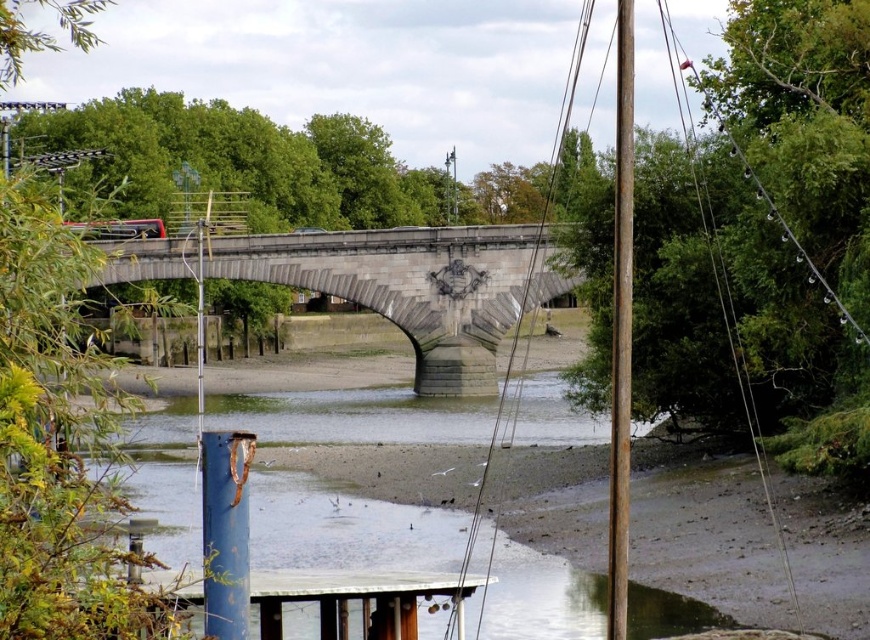
Based on the photo, does gray stone bridge at center appear on the right side of wooden dock at lower center?

No, gray stone bridge at center is not to the right of wooden dock at lower center.

At what (x,y) coordinates should I click in order to perform the action: click on gray stone bridge at center. Please return your answer as a coordinate pair (x, y). Image resolution: width=870 pixels, height=640 pixels. Looking at the image, I should click on (415, 285).

In order to click on gray stone bridge at center in this screenshot , I will do `click(415, 285)`.

Who is more distant from viewer, (623, 560) or (199, 364)?

The point (199, 364) is more distant.

What do you see at coordinates (621, 326) in the screenshot? I see `rusty metal pole at right` at bounding box center [621, 326].

What are the coordinates of `rusty metal pole at right` in the screenshot? It's located at (621, 326).

Between wooden dock at lower center and rusty metal pole at right, which one has more height?

With more height is rusty metal pole at right.

Is wooden dock at lower center in front of rusty metal pole at right?

Yes, it is in front of rusty metal pole at right.

Identify the location of wooden dock at lower center. The height and width of the screenshot is (640, 870). (357, 596).

Image resolution: width=870 pixels, height=640 pixels. What are the coordinates of `wooden dock at lower center` in the screenshot? It's located at (357, 596).